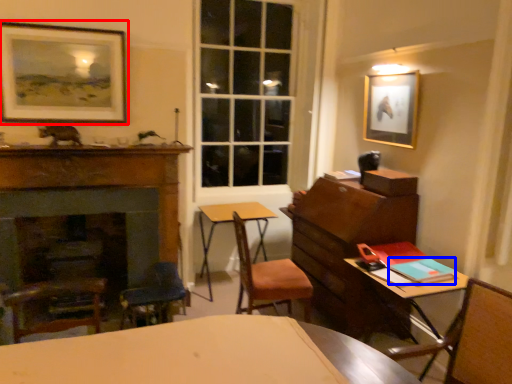
Question: Which object is further to the camera taking this photo, picture frame (highlighted by a red box) or book (highlighted by a blue box)?

Choices:
 (A) picture frame
 (B) book

Answer: (A)